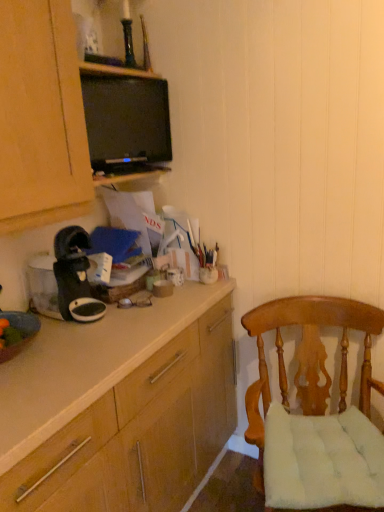
You are a GUI agent. You are given a task and a screenshot of the screen. Output one action in this format:
    pyautogui.click(x=<x>, y=<y>)
    Task: Click on the light brown wood chair at lower right
    
    Given the screenshot: What is the action you would take?
    pyautogui.click(x=316, y=416)

The width and height of the screenshot is (384, 512). What do you see at coordinates (316, 416) in the screenshot? I see `light brown wood chair at lower right` at bounding box center [316, 416].

Based on the photo, measure the distance between point [379,508] and camera.

The depth of point [379,508] is 3.88 feet.

You are a GUI agent. You are given a task and a screenshot of the screen. Output one action in this format:
    pyautogui.click(x=<x>, y=<y>)
    Task: Click on the light brown wood chair at lower right
    
    Given the screenshot: What is the action you would take?
    pyautogui.click(x=316, y=416)